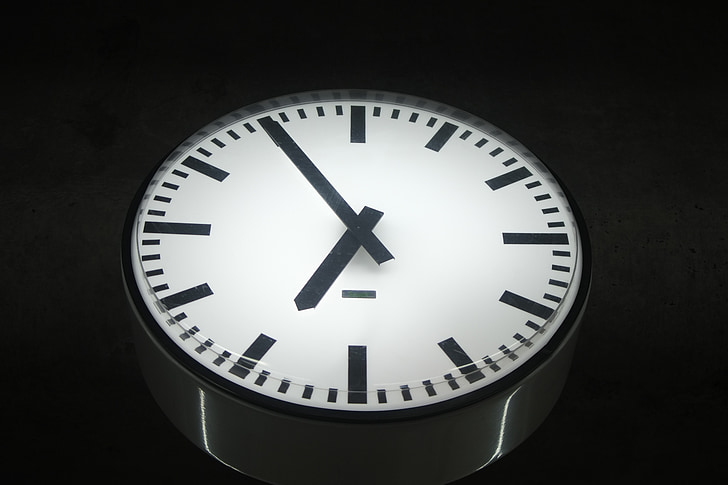
Locate an element on the screen. clock minute markers is located at coordinates (332, 395), (306, 393), (376, 112), (395, 115), (553, 223), (545, 208).